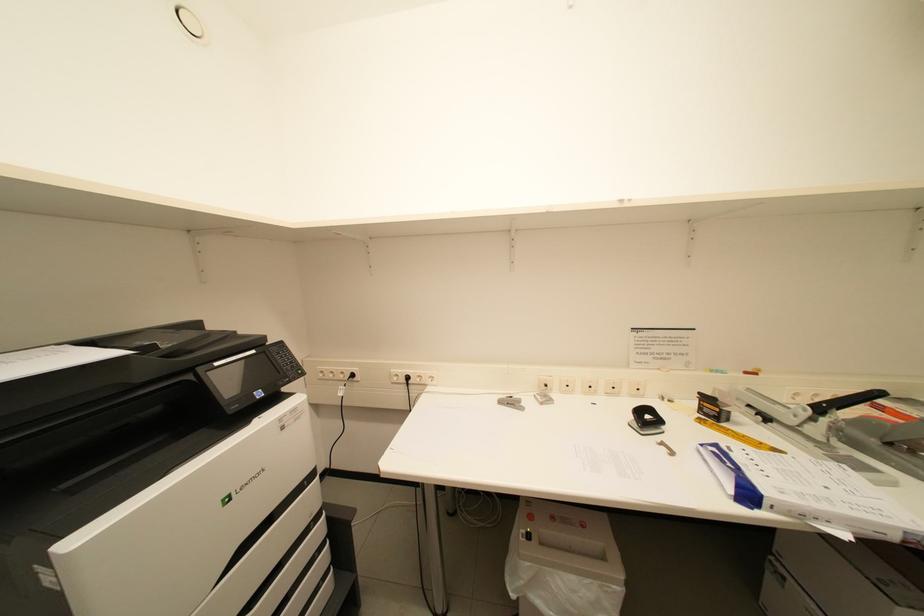
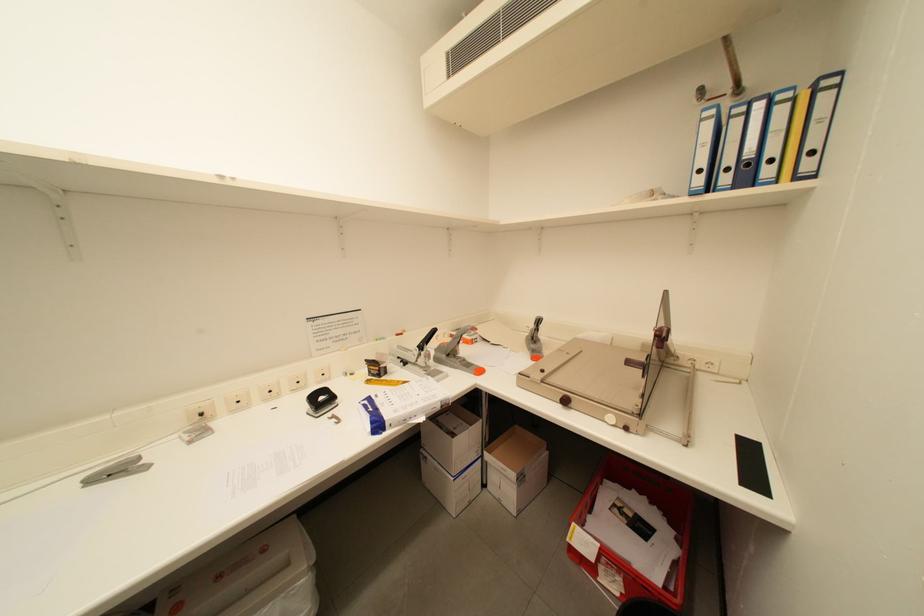
Question: The camera is either moving clockwise (left) or counter-clockwise (right) around the object. The first image is from the beginning of the video and the second image is from the end. Is the camera moving left or right when shooting the video?

Choices:
 (A) Left
 (B) Right

Answer: (A)